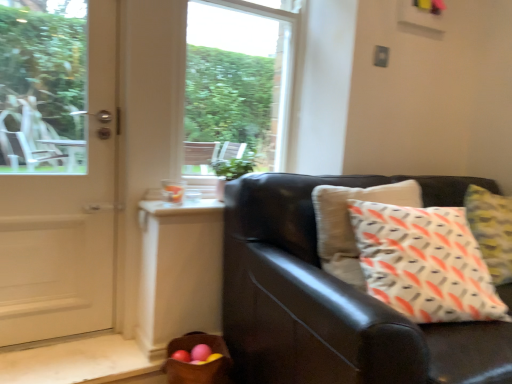
Question: Does point (425, 329) appear closer or farther from the camera than point (90, 258)?

Choices:
 (A) closer
 (B) farther

Answer: (A)

Question: Is matte black couch at right to the left or to the right of white glossy door at left in the image?

Choices:
 (A) left
 (B) right

Answer: (B)

Question: Which is nearer to the white glossy door at left?

Choices:
 (A) brown woven basket at lower left
 (B) transparent glass window at center
 (C) matte black couch at right

Answer: (A)

Question: Estimate the real-world distances between objects in this image. Which object is farther from the brown woven basket at lower left?

Choices:
 (A) matte black couch at right
 (B) transparent glass window at center
 (C) white glossy door at left

Answer: (B)